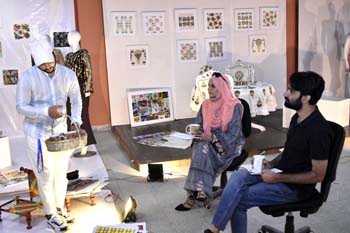
In order to click on basket in this screenshot , I will do `click(64, 138)`.